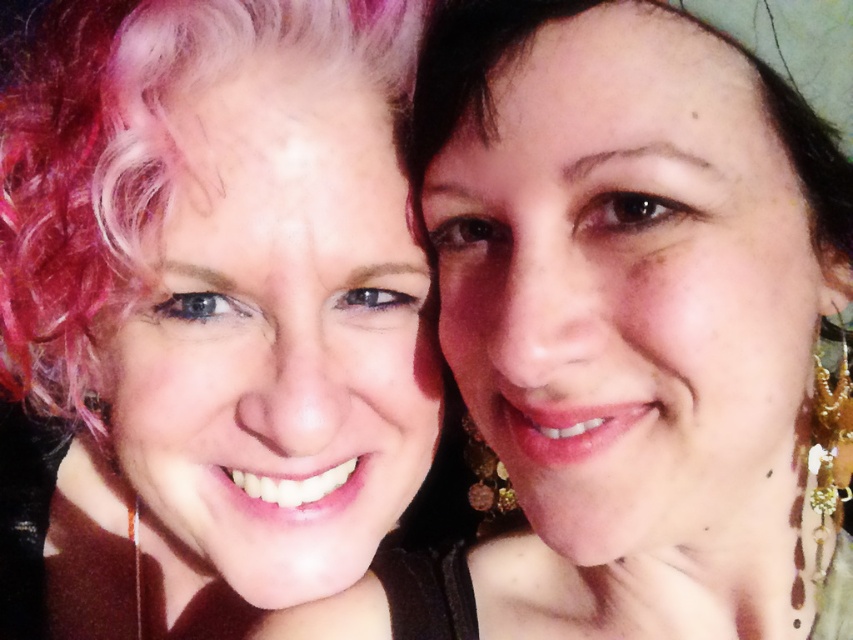
Who is more distant from viewer, (634,620) or (347,468)?

The point (347,468) is behind.

Can you confirm if matte gold earrings at right is positioned to the right of pink curly hair at center?

Indeed, matte gold earrings at right is positioned on the right side of pink curly hair at center.

Locate an element on the screen. The width and height of the screenshot is (853, 640). matte gold earrings at right is located at coordinates (630, 324).